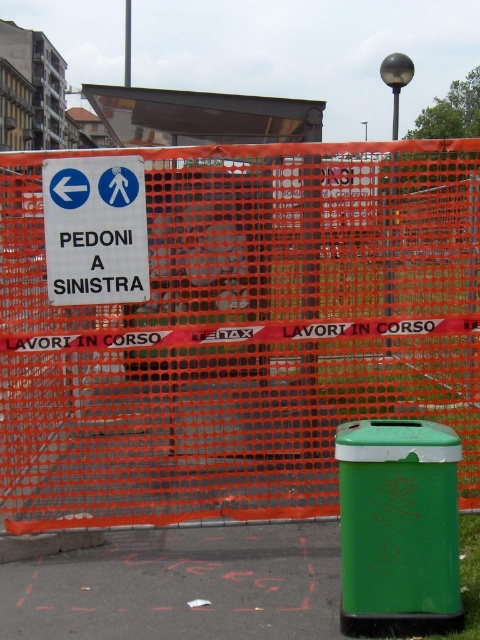
Between point (91, 564) and point (50, 188), which one is positioned behind?

The point (91, 564) is more distant.

Where is `green asphalt pavement at lower right`? The width and height of the screenshot is (480, 640). green asphalt pavement at lower right is located at coordinates (181, 586).

Can you confirm if orange mesh fence at center is positioned below green asphalt pavement at lower right?

Actually, orange mesh fence at center is above green asphalt pavement at lower right.

Does orange mesh fence at center lie behind green asphalt pavement at lower right?

Yes.

Locate an element on the screen. The image size is (480, 640). orange mesh fence at center is located at coordinates (240, 332).

The width and height of the screenshot is (480, 640). Describe the element at coordinates (240, 332) in the screenshot. I see `orange mesh fence at center` at that location.

Can you confirm if orange mesh fence at center is wider than white plastic sign at upper left?

Yes, orange mesh fence at center is wider than white plastic sign at upper left.

Is point (478, 304) farther from camera compared to point (106, 260)?

Yes, it is.

At what (x,y) coordinates should I click in order to perform the action: click on orange mesh fence at center. Please return your answer as a coordinate pair (x, y). Looking at the image, I should click on (240, 332).